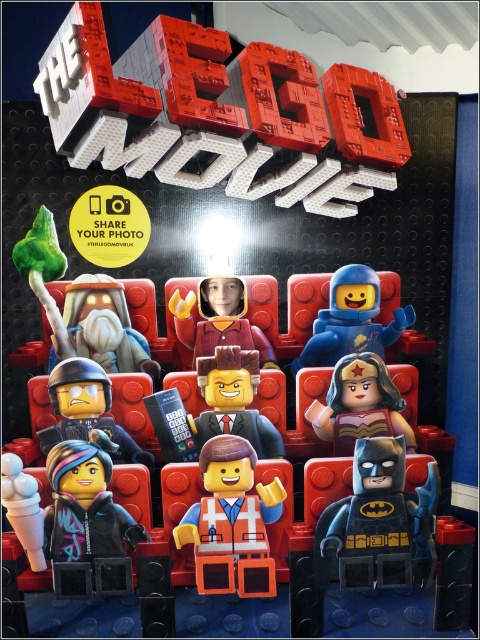
Between blue matte astronaut at center and matte black helmet at center, which one is positioned higher?

blue matte astronaut at center

Which is behind, point (292, 362) or point (95, 419)?

Positioned behind is point (292, 362).

Who is more forward, (310, 360) or (119, 433)?

Point (119, 433) is in front.

Where is `blue matte astronaut at center`? blue matte astronaut at center is located at coordinates (351, 320).

Is point (300, 438) positioned behind point (347, 444)?

That is True.

Is point (99, 339) closer to camera compared to point (405, 420)?

No.

Find the location of `matte black minifigure at center`. matte black minifigure at center is located at coordinates (45, 269).

Between matte black helmet at center and matte red minifigure at center, which one appears on the left side from the viewer's perspective?

matte black helmet at center

Is matte black helmet at center thinner than matte red minifigure at center?

Yes, matte black helmet at center is thinner than matte red minifigure at center.

Find the location of a particular element. matte black helmet at center is located at coordinates (86, 410).